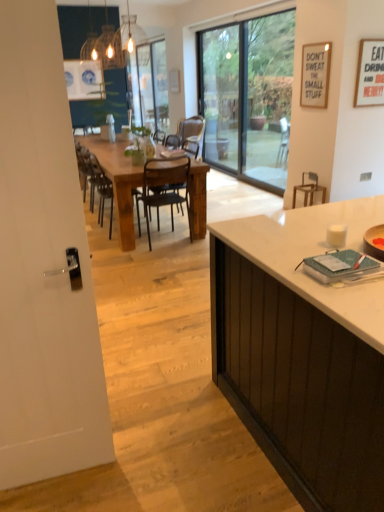
Question: Is wooden chair at center, the 3th chair positioned from the right, smaller than white matte cabinet at right?

Choices:
 (A) no
 (B) yes

Answer: (B)

Question: From a real-world perspective, is wooden chair at center, acting as the 1th chair starting from the left, on white matte cabinet at right?

Choices:
 (A) yes
 (B) no

Answer: (B)

Question: From a real-world perspective, is wooden chair at center, the 3th chair positioned from the right, positioned under white matte cabinet at right based on gravity?

Choices:
 (A) yes
 (B) no

Answer: (A)

Question: Is wooden chair at center, acting as the 1th chair starting from the left, thinner than white matte cabinet at right?

Choices:
 (A) no
 (B) yes

Answer: (B)

Question: Can you confirm if wooden chair at center, the 3th chair positioned from the right, is taller than white matte cabinet at right?

Choices:
 (A) no
 (B) yes

Answer: (A)

Question: Is point (96, 161) positioned closer to the camera than point (115, 50)?

Choices:
 (A) closer
 (B) farther

Answer: (A)

Question: Which is correct: wooden chair at center, acting as the 1th chair starting from the left, is inside matte glass chandelier at upper center, or outside of it?

Choices:
 (A) outside
 (B) inside

Answer: (A)

Question: From a real-world perspective, is wooden chair at center, the 3th chair positioned from the right, positioned above or below matte glass chandelier at upper center?

Choices:
 (A) below
 (B) above

Answer: (A)

Question: Considering the positions of wooden chair at center, the 3th chair positioned from the right, and matte glass chandelier at upper center in the image, is wooden chair at center, the 3th chair positioned from the right, bigger or smaller than matte glass chandelier at upper center?

Choices:
 (A) big
 (B) small

Answer: (A)

Question: Is transparent glass door at center inside the boundaries of white glossy door at left, which is the first screen door in bottom-to-top order, or outside?

Choices:
 (A) outside
 (B) inside

Answer: (A)

Question: Is transparent glass door at center in front of or behind white glossy door at left, which ranks as the 2th screen door in top-to-bottom order, in the image?

Choices:
 (A) front
 (B) behind

Answer: (B)

Question: From the image's perspective, relative to white glossy door at left, which is the first screen door in bottom-to-top order, is transparent glass door at center above or below?

Choices:
 (A) above
 (B) below

Answer: (A)

Question: In terms of width, does transparent glass door at center look wider or thinner when compared to white glossy door at left, which ranks as the 2th screen door in top-to-bottom order?

Choices:
 (A) wide
 (B) thin

Answer: (A)

Question: Considering the positions of point (94, 157) and point (165, 172), is point (94, 157) closer or farther from the camera than point (165, 172)?

Choices:
 (A) farther
 (B) closer

Answer: (A)

Question: Is wooden chair at center, acting as the 1th chair starting from the left, taller or shorter than metallic black chair at center, the second chair in the right-to-left sequence?

Choices:
 (A) short
 (B) tall

Answer: (A)